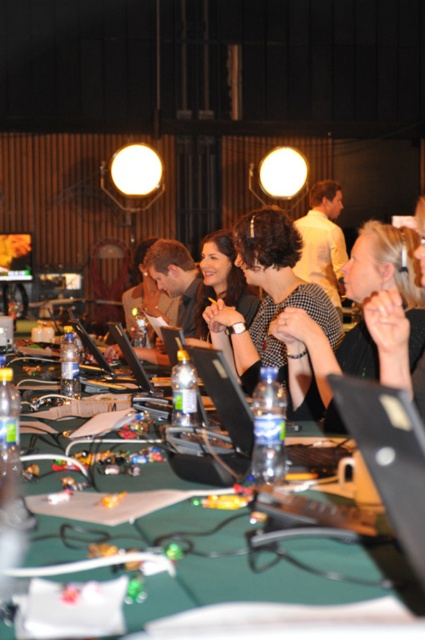
You are a photographer standing behind the group at the conference table. You want to take a photo of the matte black laptop at center without any obstruction from the black textured shirt at center. Is the laptop visible from your position?

The black textured shirt at center is much taller than the matte black laptop at center, so the shirt would likely block the view of the laptop from behind. The photographer should move to a lower angle or position to avoid the obstruction.

You are sitting at the table and want to hand a document to the person wearing the black textured shirt at center. The document is on the matte black laptop at center. Which direction should you move the document to reach the person?

The black textured shirt at center is to the right of the matte black laptop at center, so you should move the document to the right to reach the person.

You are standing in the conference room and want to find the black textured shirt at center. According to the coordinates provided, where should you look to locate it?

The black textured shirt at center is located at coordinates point (322, 364).